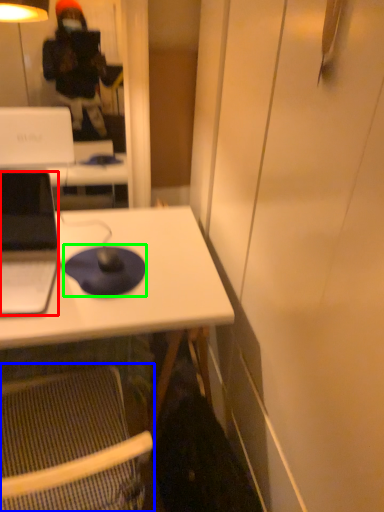
Question: Which is farther away from laptop (highlighted by a red box)? folding chair (highlighted by a blue box) or mousepad (highlighted by a green box)?

Choices:
 (A) folding chair
 (B) mousepad

Answer: (A)